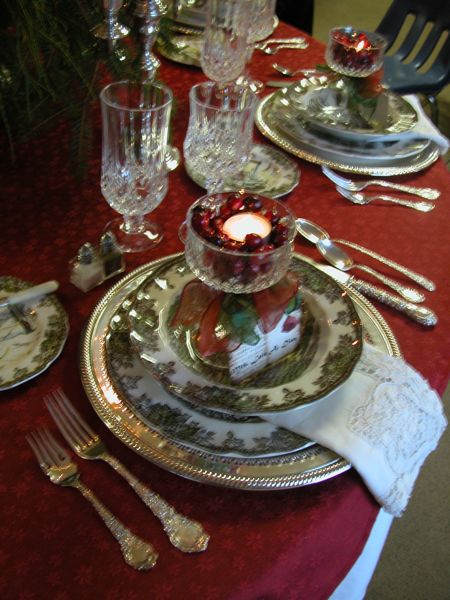
The width and height of the screenshot is (450, 600). I want to click on spoon, so click(x=339, y=264), click(x=304, y=223), click(x=350, y=198), click(x=270, y=49), click(x=263, y=42), click(x=286, y=69).